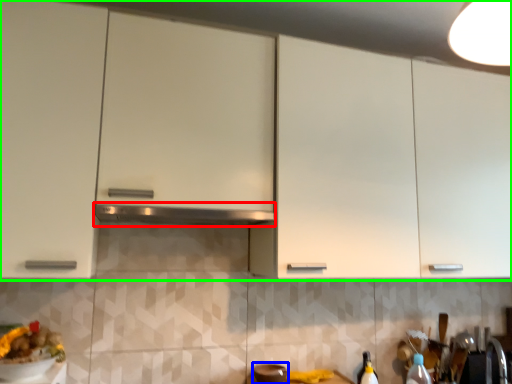
Question: Estimate the real-world distances between objects in this image. Which object is closer to exhaust hood (highlighted by a red box), appliance (highlighted by a blue box) or cabinetry (highlighted by a green box)?

Choices:
 (A) appliance
 (B) cabinetry

Answer: (B)